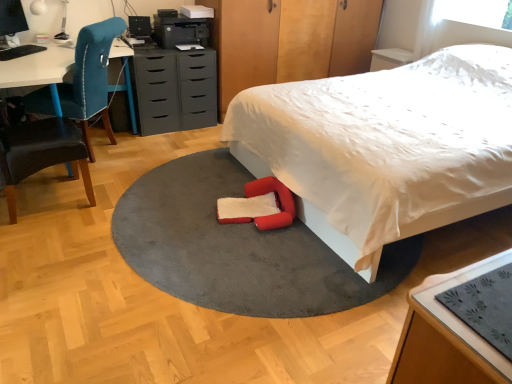
Question: From the image's perspective, is matte gray chest of drawers at center under white soft bed at center?

Choices:
 (A) yes
 (B) no

Answer: (B)

Question: Considering the relative sizes of matte gray chest of drawers at center and white soft bed at center in the image provided, is matte gray chest of drawers at center thinner than white soft bed at center?

Choices:
 (A) no
 (B) yes

Answer: (B)

Question: Is matte gray chest of drawers at center turned away from white soft bed at center?

Choices:
 (A) no
 (B) yes

Answer: (A)

Question: Is matte gray chest of drawers at center at the right side of white soft bed at center?

Choices:
 (A) no
 (B) yes

Answer: (A)

Question: Is matte gray chest of drawers at center touching white soft bed at center?

Choices:
 (A) yes
 (B) no

Answer: (B)

Question: Is black matte printer at upper center bigger or smaller than wooden dresser at upper center?

Choices:
 (A) big
 (B) small

Answer: (B)

Question: From a real-world perspective, is black matte printer at upper center positioned above or below wooden dresser at upper center?

Choices:
 (A) above
 (B) below

Answer: (A)

Question: Is black matte printer at upper center situated inside wooden dresser at upper center or outside?

Choices:
 (A) inside
 (B) outside

Answer: (B)

Question: In terms of height, does black matte printer at upper center look taller or shorter compared to wooden dresser at upper center?

Choices:
 (A) short
 (B) tall

Answer: (A)

Question: Is wooden table at lower right taller or shorter than wooden dresser at upper center?

Choices:
 (A) short
 (B) tall

Answer: (A)

Question: From a real-world perspective, is wooden table at lower right above or below wooden dresser at upper center?

Choices:
 (A) below
 (B) above

Answer: (A)

Question: In terms of width, does wooden table at lower right look wider or thinner when compared to wooden dresser at upper center?

Choices:
 (A) thin
 (B) wide

Answer: (A)

Question: Is point (476, 274) positioned closer to the camera than point (245, 49)?

Choices:
 (A) closer
 (B) farther

Answer: (A)

Question: From the image's perspective, is wooden table at lower right above or below velvet teal chair at left, the second chair when ordered from back to front?

Choices:
 (A) above
 (B) below

Answer: (B)

Question: In terms of size, does wooden table at lower right appear bigger or smaller than velvet teal chair at left, the 1th chair viewed from the front?

Choices:
 (A) big
 (B) small

Answer: (B)